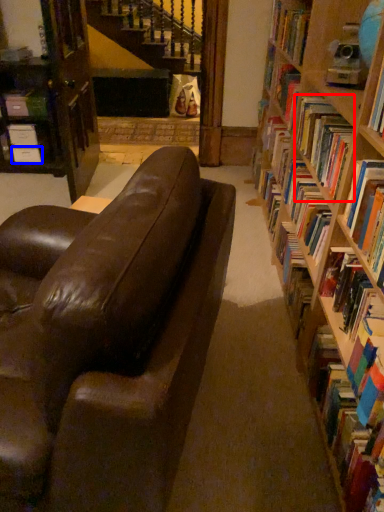
Question: Which point is closer to the camera, book (highlighted by a red box) or paperback book (highlighted by a blue box)?

Choices:
 (A) book
 (B) paperback book

Answer: (A)